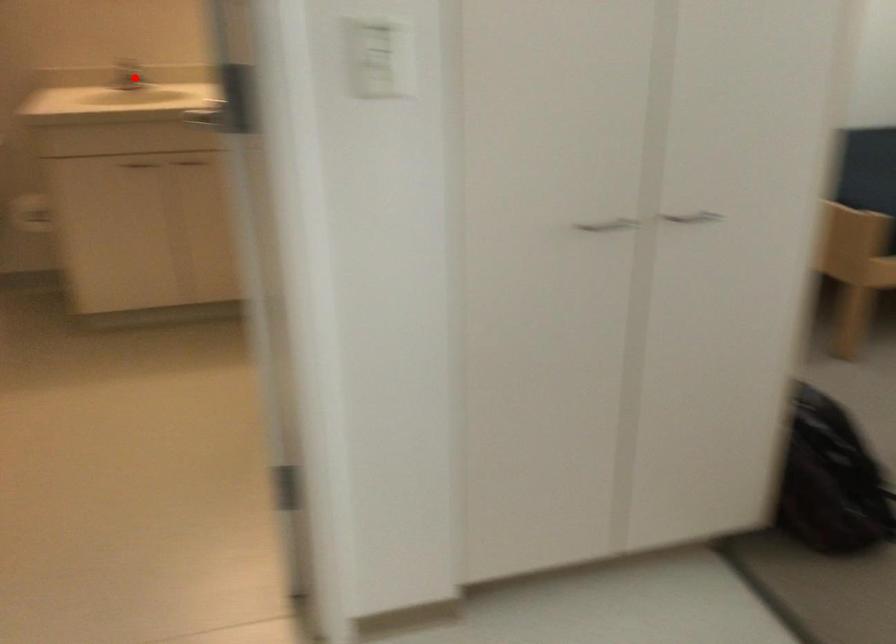
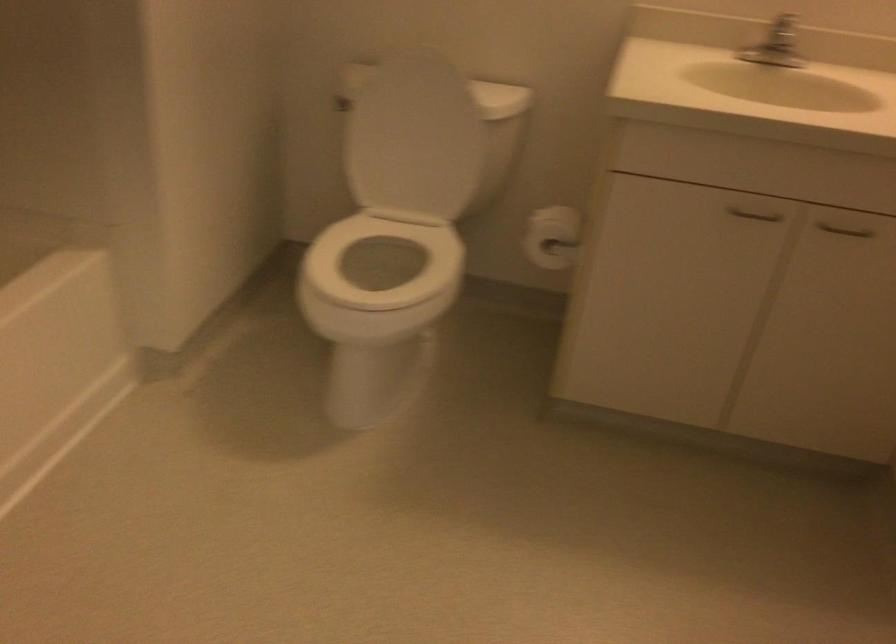
The point at the highlighted location is marked in the first image. Where is the corresponding point in the second image?

(778, 55)